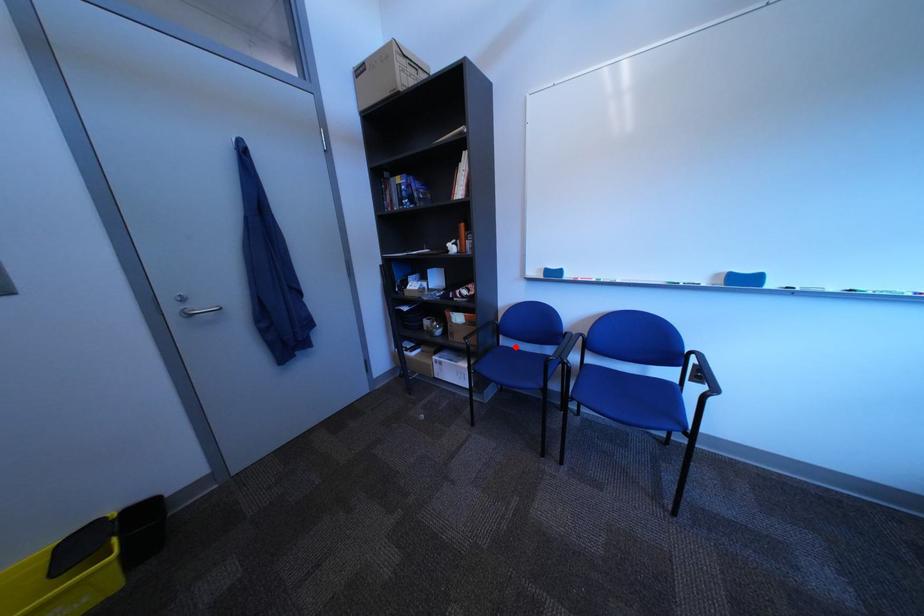
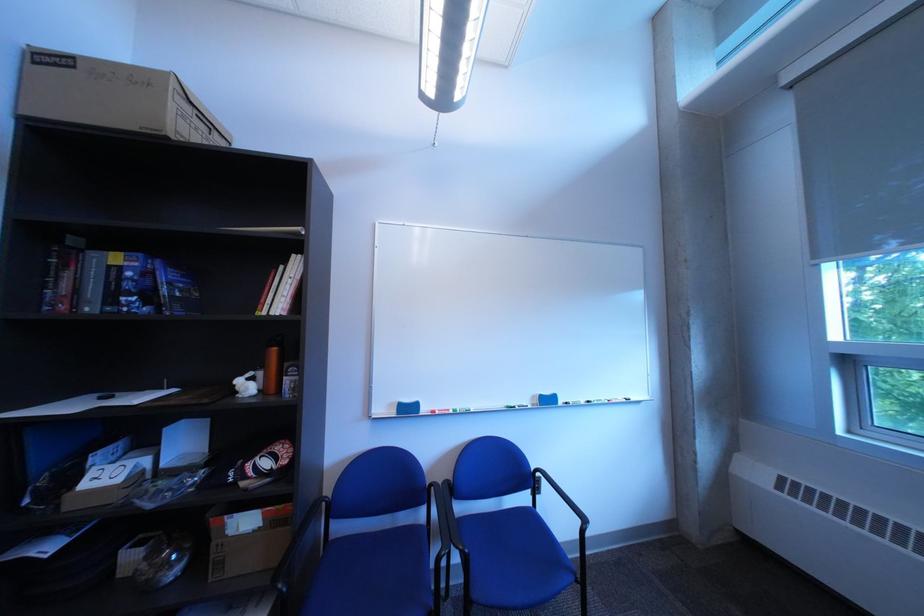
Find the pixel in the second image that matches the highlighted location in the first image.

(346, 541)